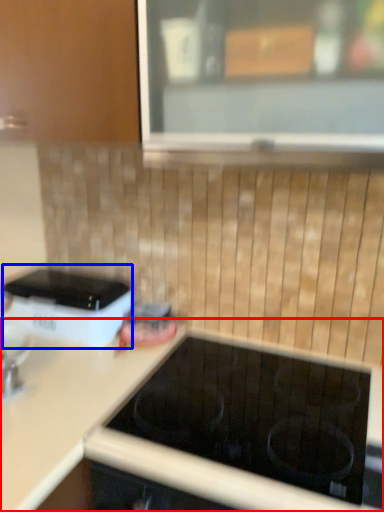
Question: Among these objects, which one is nearest to the camera, countertop (highlighted by a red box) or home appliance (highlighted by a blue box)?

Choices:
 (A) countertop
 (B) home appliance

Answer: (A)